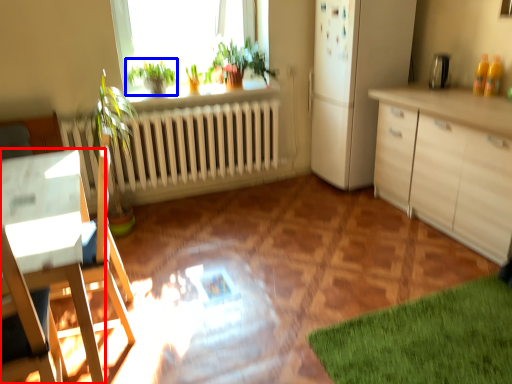
Question: Among these objects, which one is nearest to the camera, desk (highlighted by a red box) or plant (highlighted by a blue box)?

Choices:
 (A) desk
 (B) plant

Answer: (A)